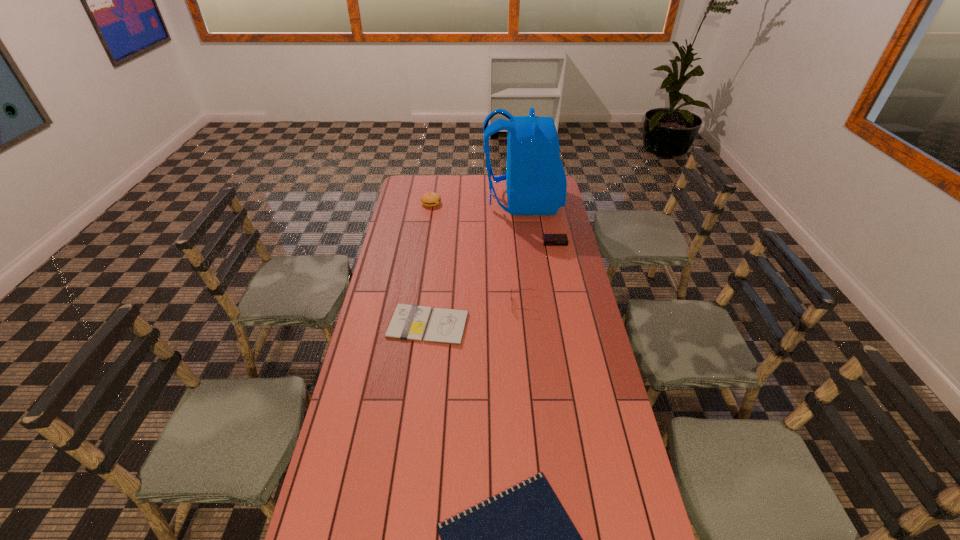
You are a GUI agent. You are given a task and a screenshot of the screen. Output one action in this format:
    pyautogui.click(x=<x>, y=<y>)
    Task: Click on the tallest object
    The height and width of the screenshot is (540, 960).
    Given the screenshot: What is the action you would take?
    pyautogui.click(x=536, y=183)

At what (x,y) coordinates should I click in order to perform the action: click on patty. Please return your answer as a coordinate pair (x, y). Looking at the image, I should click on (429, 199).

Where is `spectacles`? Image resolution: width=960 pixels, height=540 pixels. spectacles is located at coordinates (523, 289).

The height and width of the screenshot is (540, 960). Find the location of `the fourth tallest object`. the fourth tallest object is located at coordinates (548, 239).

Find the location of `alarm clock`. alarm clock is located at coordinates (548, 239).

Find the location of a particular element. the second shortest object is located at coordinates (409, 322).

Locate an element on the screen. The height and width of the screenshot is (540, 960). the farther notepad is located at coordinates (409, 322).

The height and width of the screenshot is (540, 960). Identify the location of free space located 0.350m on the back of the tallest object. (416, 201).

In order to click on vacant space located 0.080m on the back of the tallest object in this screenshot , I will do `click(468, 201)`.

You are a GUI agent. You are given a task and a screenshot of the screen. Output one action in this format:
    pyautogui.click(x=<x>, y=<y>)
    Task: Click on the vacant space situated on the back of the tallest object
    
    Given the screenshot: What is the action you would take?
    pyautogui.click(x=437, y=201)